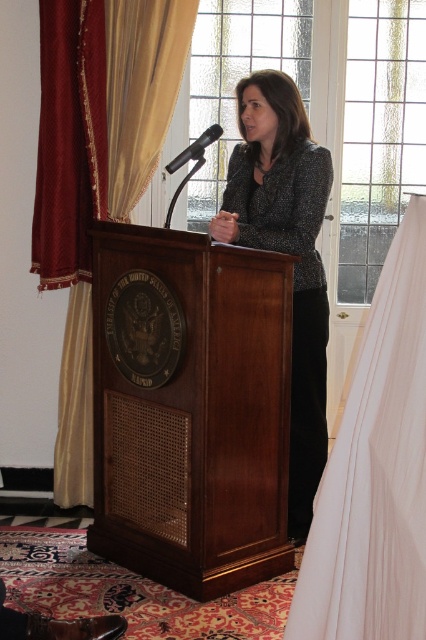
You are a photographer at the event and want to capture the black textured blazer at center in your shot. Based on its coordinates, where should you position your camera to ensure it is centered in the frame?

The black textured blazer at center is located at coordinates point (285,252), so positioning the camera to center the frame at those coordinates will ensure the blazer is centered in the shot.

In the scene shown: You are a photographer positioned in front of the scene. You need to adjust your camera to focus on both the black textured blazer at center and the black metallic microphone at center. Which object should you focus on first to ensure proper depth of field?

The black textured blazer at center is much taller than the black metallic microphone at center, so you should focus on the black metallic microphone at center first to ensure proper depth of field.

You are a stagehand who needs to move a 6.5 feet wide screen between the white fabric at right and the silky gold curtain at left. Can the screen fit through the space between them?

The distance between the white fabric at right and the silky gold curtain at left is 6.82 feet. Since the screen is 6.5 feet wide, it can fit through the space between them as there is enough clearance.